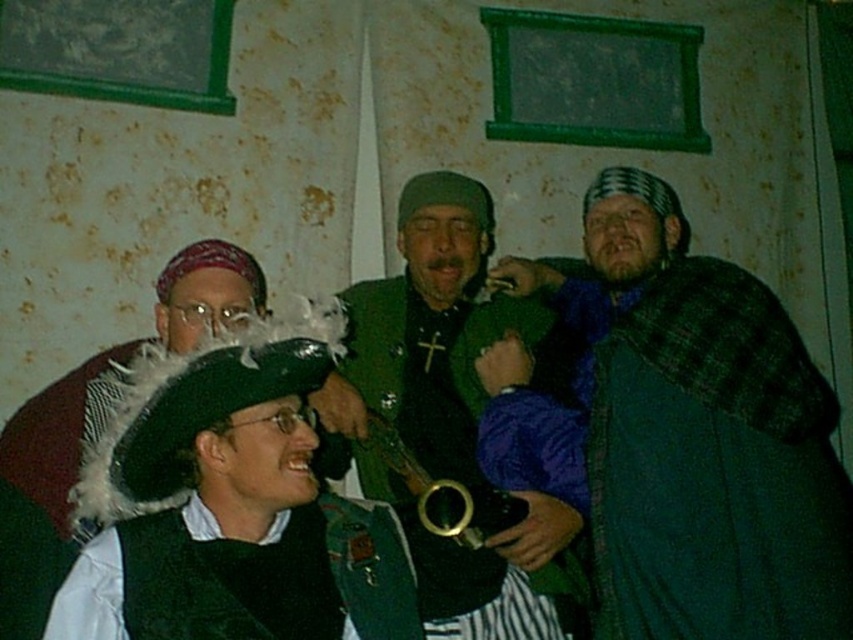
You are a costume designer preparing for a play. You have two green items in your collection, the velvet green vest at center and the green woolen cloak at right. Which one would you choose if you need a smaller costume piece for a character who needs to move freely?

The velvet green vest at center is smaller than the green woolen cloak at right, so it would be the better choice for a character needing to move freely as it is more compact.

In the scene with the group of four people against a rustic wall with two green window frames, you notice two green items of clothing. The velvet green vest at center and the green woolen cloak at right. Which of these two items is positioned higher up on the person wearing it?

The velvet green vest at center is positioned higher up on the person wearing it compared to the green woolen cloak at right, as it is described as being above the cloak.

You are a photographer trying to capture a closeup shot of both the velvet green vest at center and the green woolen cloak at right. Given that your camera has a maximum focus range of 1 inch, can you fit both objects into the frame without moving the camera?

The velvet green vest at center and the green woolen cloak at right are 1.22 inches apart, which exceeds the camera maximum focus range of 1 inch. Therefore, you cannot fit both objects into the frame without moving the camera.